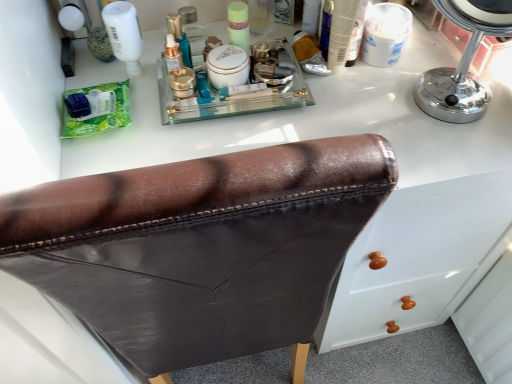
Find the location of a particular element. Image resolution: width=512 pixels, height=384 pixels. vacant area on the back side of green matte packet at left is located at coordinates (113, 70).